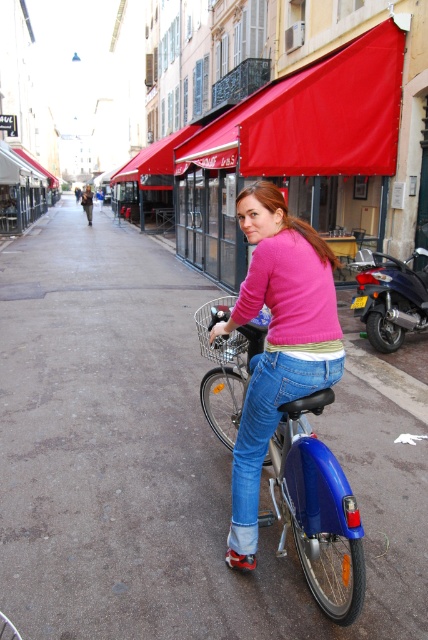
Between point (333, 456) and point (237, 444), which one is positioned behind?

The point (333, 456) is behind.

From the picture: Can you confirm if blue metallic bicycle at center is shorter than jeans at center?

Correct, blue metallic bicycle at center is not as tall as jeans at center.

Which is behind, point (311, 557) or point (256, 481)?

Point (256, 481)

Identify the location of blue metallic bicycle at center. This screenshot has width=428, height=640. (317, 509).